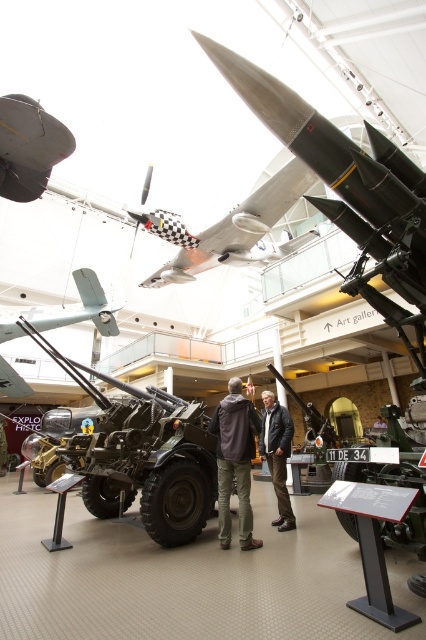
Does matte black missile at upper center appear over matte gray propeller at center?

Yes, matte black missile at upper center is above matte gray propeller at center.

Is matte black missile at upper center closer to the viewer compared to matte gray propeller at center?

Yes, matte black missile at upper center is closer to the viewer.

The width and height of the screenshot is (426, 640). Identify the location of matte black missile at upper center. (28, 147).

This screenshot has width=426, height=640. I want to click on matte black missile at upper center, so click(28, 147).

Can you confirm if green matte tank at center is bigger than matte gray propeller at center?

Correct, green matte tank at center is larger in size than matte gray propeller at center.

Is green matte tank at center taller than matte gray propeller at center?

Indeed, green matte tank at center has a greater height compared to matte gray propeller at center.

Identify the location of green matte tank at center. (143, 454).

Where is `green matte tank at center`? green matte tank at center is located at coordinates (143, 454).

Is dark gray jacket at center positioned behind light brown leather jacket at center?

No, dark gray jacket at center is closer to the viewer.

Which is below, dark gray jacket at center or light brown leather jacket at center?

light brown leather jacket at center is lower down.

Between point (256, 544) and point (385, 426), which one is positioned behind?

The point (385, 426) is more distant.

At what (x,y) coordinates should I click in order to perform the action: click on dark gray jacket at center. Please return your answer as a coordinate pair (x, y). The image size is (426, 640). Looking at the image, I should click on (235, 461).